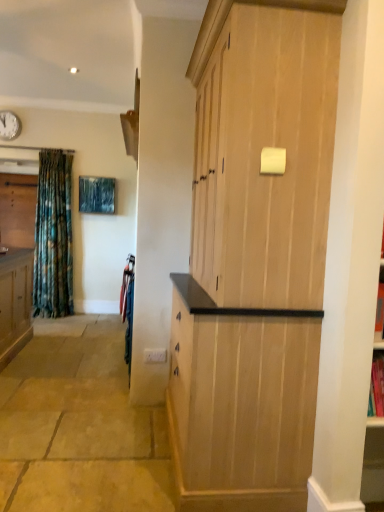
Question: Is natural wood cupboard at center spatially inside white matte clock at upper left, or outside of it?

Choices:
 (A) inside
 (B) outside

Answer: (B)

Question: Is natural wood cupboard at center to the left or to the right of white matte clock at upper left in the image?

Choices:
 (A) left
 (B) right

Answer: (B)

Question: From the image's perspective, is natural wood cupboard at center above or below white matte clock at upper left?

Choices:
 (A) below
 (B) above

Answer: (A)

Question: In the image, is white matte clock at upper left positioned in front of or behind natural wood cupboard at center?

Choices:
 (A) front
 (B) behind

Answer: (B)

Question: From a real-world perspective, is white matte clock at upper left positioned above or below natural wood cupboard at center?

Choices:
 (A) above
 (B) below

Answer: (A)

Question: Is point (16, 117) closer or farther from the camera than point (281, 14)?

Choices:
 (A) farther
 (B) closer

Answer: (A)

Question: Considering the positions of white matte clock at upper left and natural wood cupboard at center in the image, is white matte clock at upper left taller or shorter than natural wood cupboard at center?

Choices:
 (A) tall
 (B) short

Answer: (B)